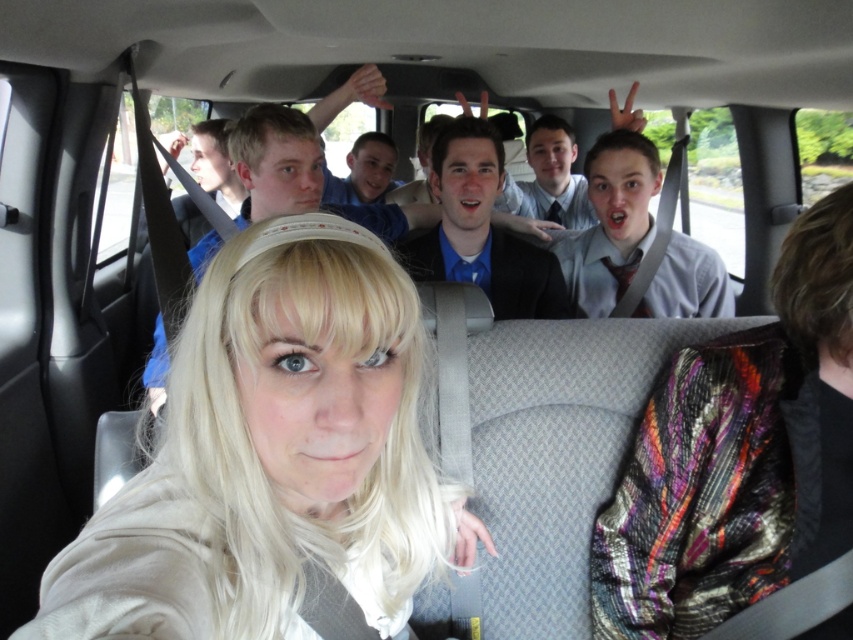
Does blonde hair at center appear under metallic sequined scarf at rear center?

Incorrect, blonde hair at center is not positioned below metallic sequined scarf at rear center.

Does point (233, 284) lie behind point (743, 394)?

No, (233, 284) is in front of (743, 394).

Find the location of a particular element. The width and height of the screenshot is (853, 640). blonde hair at center is located at coordinates (274, 458).